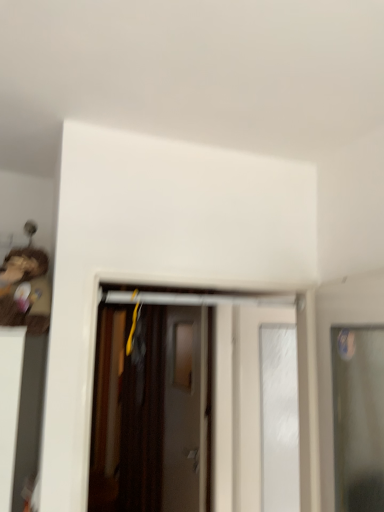
Question: Is wooden toy at left in front of or behind white glossy door at center, which is counted as the 3th door, starting from the front, in the image?

Choices:
 (A) behind
 (B) front

Answer: (B)

Question: Based on their positions, is wooden toy at left located to the left or right of white glossy door at center, the second door positioned from the back?

Choices:
 (A) right
 (B) left

Answer: (B)

Question: Estimate the real-world distances between objects in this image. Which object is farther from the wooden door at center, which appears as the 4th door when viewed from the front?

Choices:
 (A) transparent glass door at right, placed as the fourth door when sorted from back to front
 (B) matte brown door at center, positioned as the second door in front-to-back order
 (C) white glossy door at center, which is counted as the 3th door, starting from the front
 (D) wooden toy at left

Answer: (D)

Question: Which object is the farthest from the matte brown door at center, which is counted as the third door, starting from the back?

Choices:
 (A) wooden door at center, which appears as the 4th door when viewed from the front
 (B) white glossy door at center, the second door positioned from the back
 (C) wooden toy at left
 (D) transparent glass door at right, placed as the fourth door when sorted from back to front

Answer: (C)